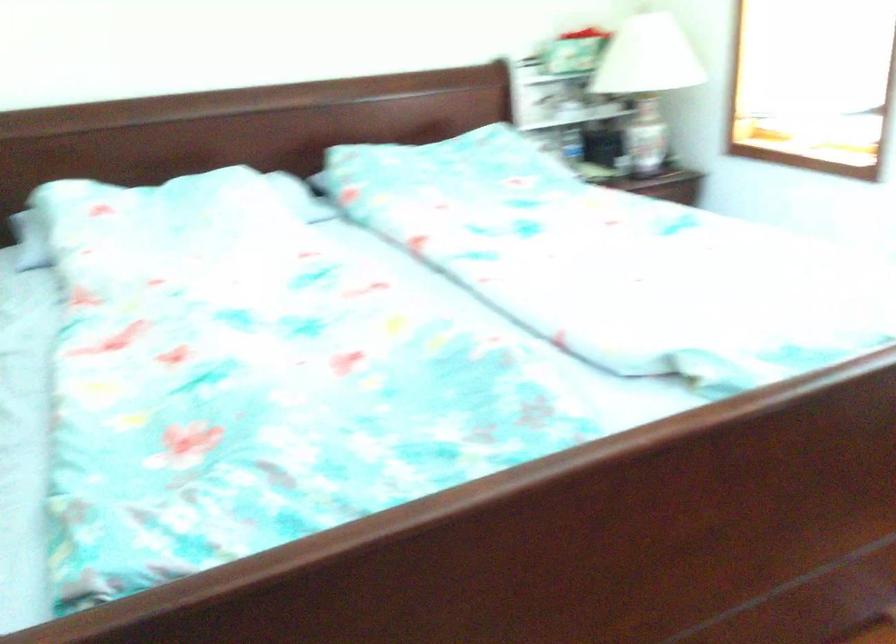
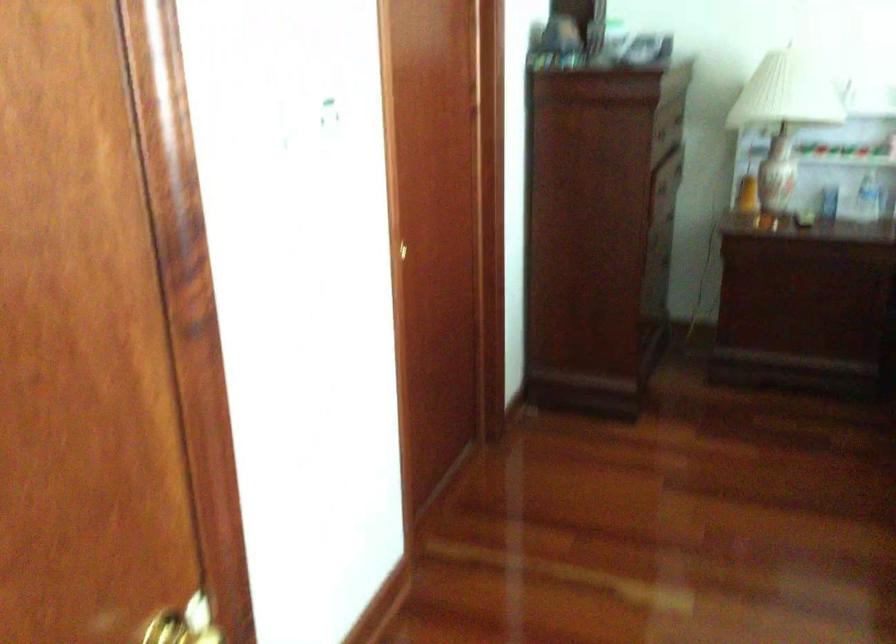
Question: The images are taken continuously from a first-person perspective. In which direction is your viewpoint rotating?

Choices:
 (A) Left
 (B) Right
 (C) Up
 (D) Down

Answer: (A)